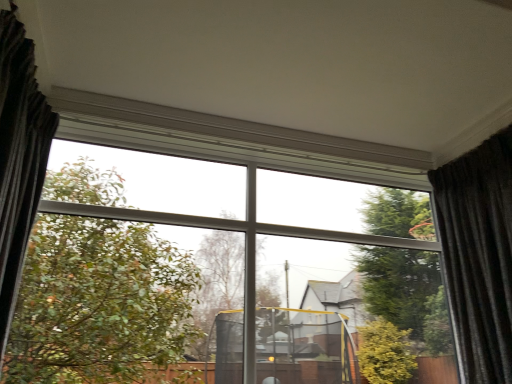
Question: Is dark gray textured curtain at left, arranged as the 2th curtain when viewed from the right, further to the viewer compared to dark grey textured curtain at right, placed as the 1th curtain when sorted from right to left?

Choices:
 (A) yes
 (B) no

Answer: (B)

Question: From a real-world perspective, is dark gray textured curtain at left, arranged as the 2th curtain when viewed from the right, on dark grey textured curtain at right, placed as the 1th curtain when sorted from right to left?

Choices:
 (A) no
 (B) yes

Answer: (B)

Question: Is dark gray textured curtain at left, the first curtain viewed from the left, closer to camera compared to dark grey textured curtain at right, placed as the 1th curtain when sorted from right to left?

Choices:
 (A) no
 (B) yes

Answer: (B)

Question: Is dark gray textured curtain at left, arranged as the 2th curtain when viewed from the right, outside of dark grey textured curtain at right, placed as the 1th curtain when sorted from right to left?

Choices:
 (A) yes
 (B) no

Answer: (A)

Question: Is dark gray textured curtain at left, the first curtain viewed from the left, at the left side of dark grey textured curtain at right, the 2th curtain viewed from the left?

Choices:
 (A) yes
 (B) no

Answer: (A)

Question: Does dark gray textured curtain at left, arranged as the 2th curtain when viewed from the right, have a larger size compared to dark grey textured curtain at right, placed as the 1th curtain when sorted from right to left?

Choices:
 (A) no
 (B) yes

Answer: (A)

Question: Is dark grey textured curtain at right, the 2th curtain viewed from the left, shorter than dark gray textured curtain at left, the first curtain viewed from the left?

Choices:
 (A) no
 (B) yes

Answer: (A)

Question: Would you say dark gray textured curtain at left, arranged as the 2th curtain when viewed from the right, is part of dark grey textured curtain at right, the 2th curtain viewed from the left,'s contents?

Choices:
 (A) yes
 (B) no

Answer: (B)

Question: Is dark grey textured curtain at right, the 2th curtain viewed from the left, outside dark gray textured curtain at left, the first curtain viewed from the left?

Choices:
 (A) no
 (B) yes

Answer: (B)

Question: Is dark grey textured curtain at right, the 2th curtain viewed from the left, oriented towards dark gray textured curtain at left, arranged as the 2th curtain when viewed from the right?

Choices:
 (A) yes
 (B) no

Answer: (A)

Question: Is dark grey textured curtain at right, the 2th curtain viewed from the left, to the left of dark gray textured curtain at left, the first curtain viewed from the left, from the viewer's perspective?

Choices:
 (A) yes
 (B) no

Answer: (B)

Question: Does dark grey textured curtain at right, the 2th curtain viewed from the left, lie behind dark gray textured curtain at left, arranged as the 2th curtain when viewed from the right?

Choices:
 (A) no
 (B) yes

Answer: (B)

Question: Is dark grey textured curtain at right, placed as the 1th curtain when sorted from right to left, taller or shorter than dark gray textured curtain at left, arranged as the 2th curtain when viewed from the right?

Choices:
 (A) short
 (B) tall

Answer: (B)